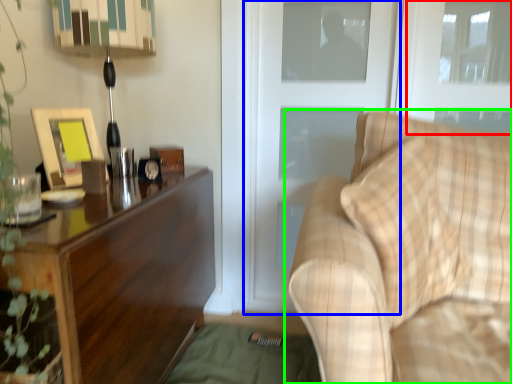
Question: Considering the real-world distances, which object is closest to window (highlighted by a red box)? screen door (highlighted by a blue box) or studio couch (highlighted by a green box).

Choices:
 (A) screen door
 (B) studio couch

Answer: (A)